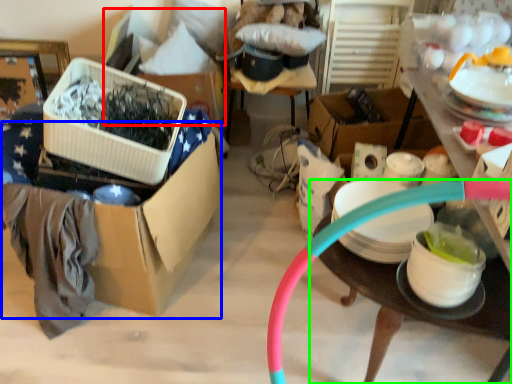
Question: Considering the real-world distances, which object is closest to storage box (highlighted by a red box)? storage box (highlighted by a blue box) or table (highlighted by a green box).

Choices:
 (A) storage box
 (B) table

Answer: (A)